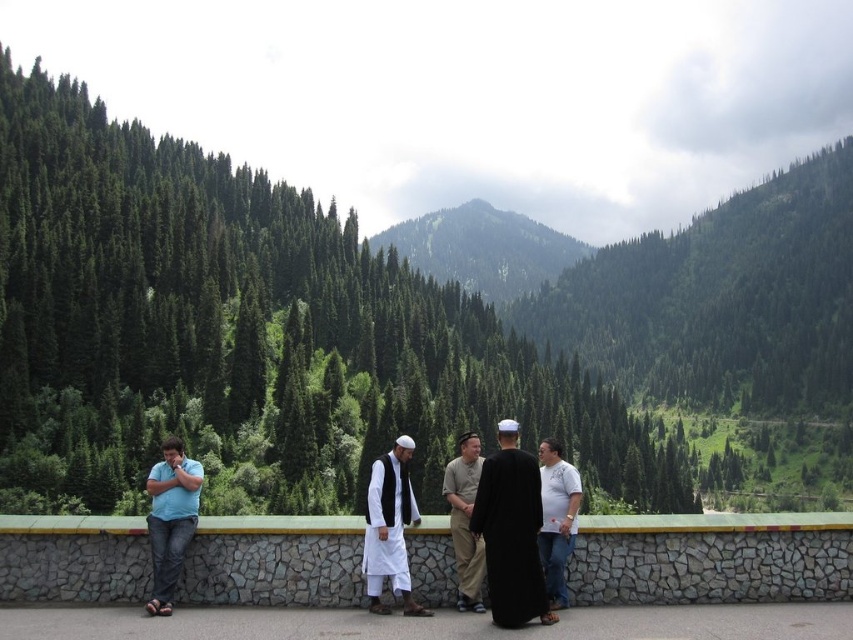
You are a photographer wanting to capture the green forested mountain at center and the white cotton robe at center in the same frame. Based on their positions, which object is located to the right of the other?

The green forested mountain at center is positioned on the right side of white cotton robe at center.

Looking at this image, you are a photographer trying to capture a group photo of the people in the scene. The two central figures, the black matte robe at center and the white cotton shirt at center, are standing apart. How far apart are they?

The black matte robe at center is 7.06 feet from the white cotton shirt at center, so they are 7.06 feet apart.

You are a photographer wanting to capture a group photo of the five people in the scene. The camera you are using has a maximum focus range of 25 feet. Can you include both the stone textured ledge at center and the blue jeans at left in the same photo without moving the camera or the subjects?

The distance between the stone textured ledge at center and the blue jeans at left is 28.56 feet, which exceeds the camera maximum focus range of 25 feet. Therefore, it is not possible to include both in the same photo without moving the camera or the subjects.